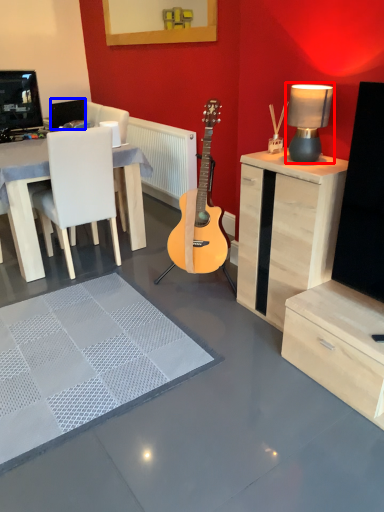
Question: Among these objects, which one is nearest to the camera, table lamp (highlighted by a red box) or speaker (highlighted by a blue box)?

Choices:
 (A) table lamp
 (B) speaker

Answer: (A)